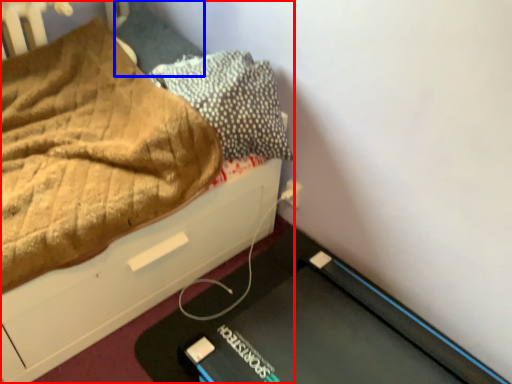
Question: Among these objects, which one is farthest to the camera, bed (highlighted by a red box) or pillow (highlighted by a blue box)?

Choices:
 (A) bed
 (B) pillow

Answer: (B)